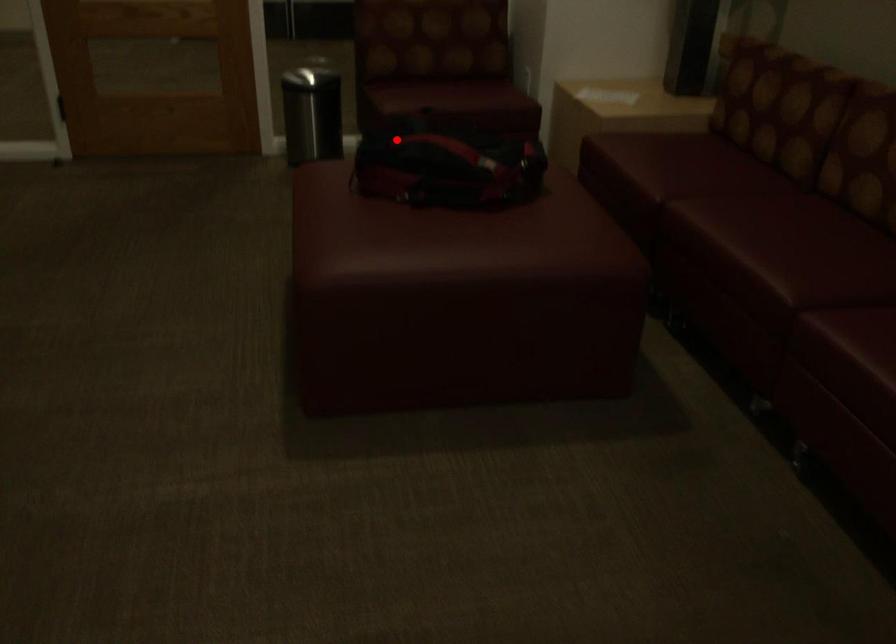
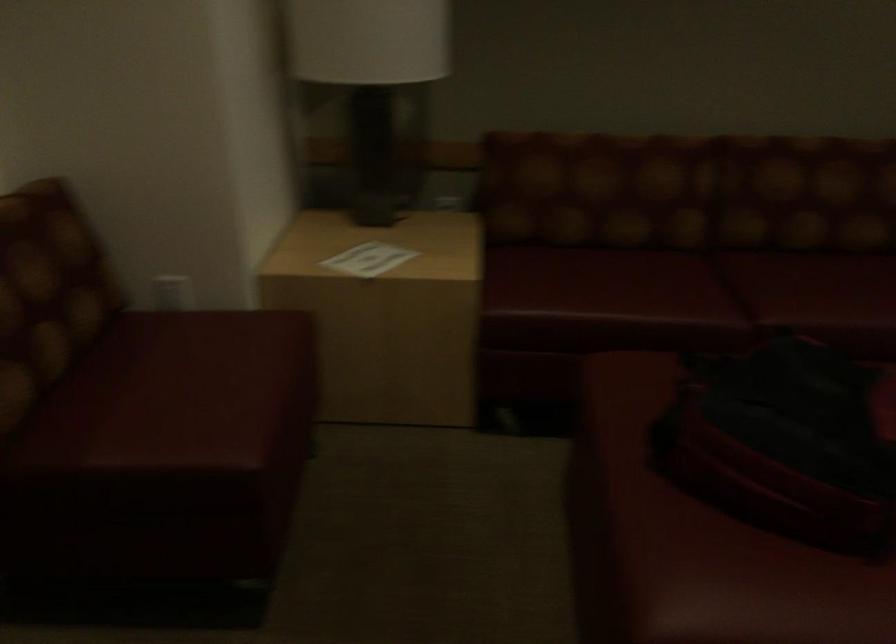
Question: I am providing you with two images of the same scene from different viewpoints. Image1 has a red point marked. In image2, the corresponding 3D location appears at what relative position? Reply with the corresponding letter.

Choices:
 (A) Closer
 (B) Farther

Answer: (A)